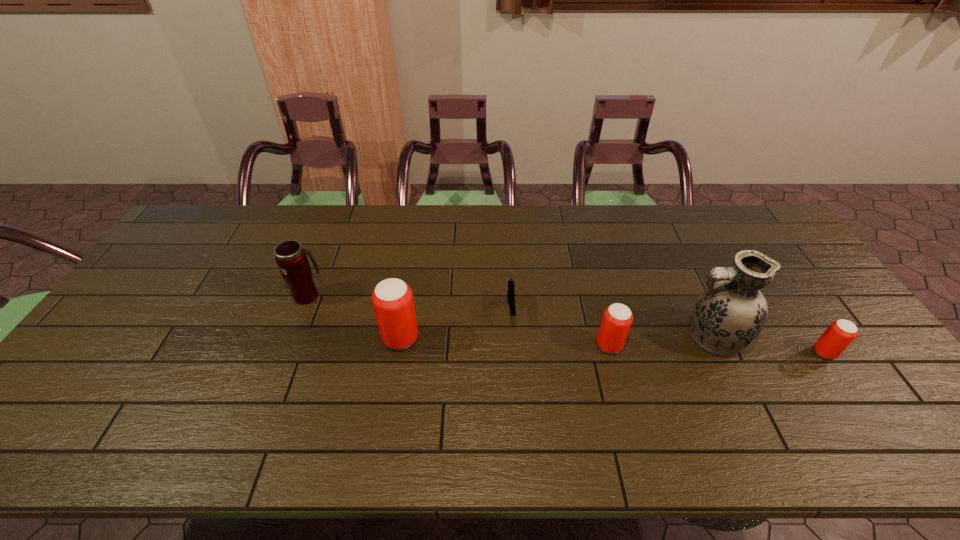
Locate an element on the screen. The width and height of the screenshot is (960, 540). the leftmost beer can is located at coordinates (392, 298).

Where is `the tallest beer can`? The width and height of the screenshot is (960, 540). the tallest beer can is located at coordinates (392, 298).

At what (x,y) coordinates should I click in order to perform the action: click on the second shortest beer can. Please return your answer as a coordinate pair (x, y). Looking at the image, I should click on (617, 319).

Identify the location of the third object from right to left. The height and width of the screenshot is (540, 960). (617, 319).

This screenshot has width=960, height=540. In order to click on the shortest beer can in this screenshot , I will do `click(836, 338)`.

Locate an element on the screen. the fifth tallest object is located at coordinates (836, 338).

Where is `the leftmost object`? This screenshot has width=960, height=540. the leftmost object is located at coordinates (290, 256).

The height and width of the screenshot is (540, 960). What are the coordinates of `the third object from left to right` in the screenshot? It's located at pyautogui.click(x=511, y=291).

I want to click on pistol, so click(x=511, y=291).

Locate an element on the screen. This screenshot has width=960, height=540. vase is located at coordinates (728, 315).